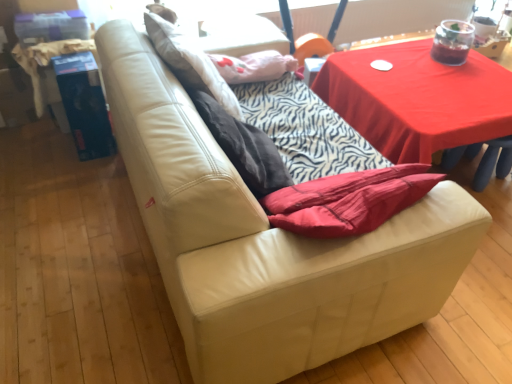
What do you see at coordinates (417, 99) in the screenshot? The image size is (512, 384). I see `smooth red table at upper right` at bounding box center [417, 99].

Identify the location of smooth red table at upper right. The height and width of the screenshot is (384, 512). (417, 99).

Image resolution: width=512 pixels, height=384 pixels. I want to click on smooth red table at upper right, so click(417, 99).